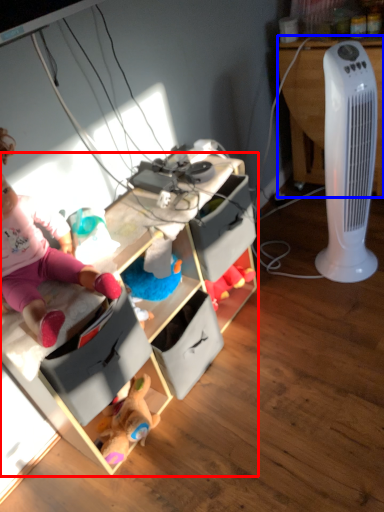
Question: Which object appears closest to the camera in this image, cabinetry (highlighted by a red box) or desk (highlighted by a blue box)?

Choices:
 (A) cabinetry
 (B) desk

Answer: (A)